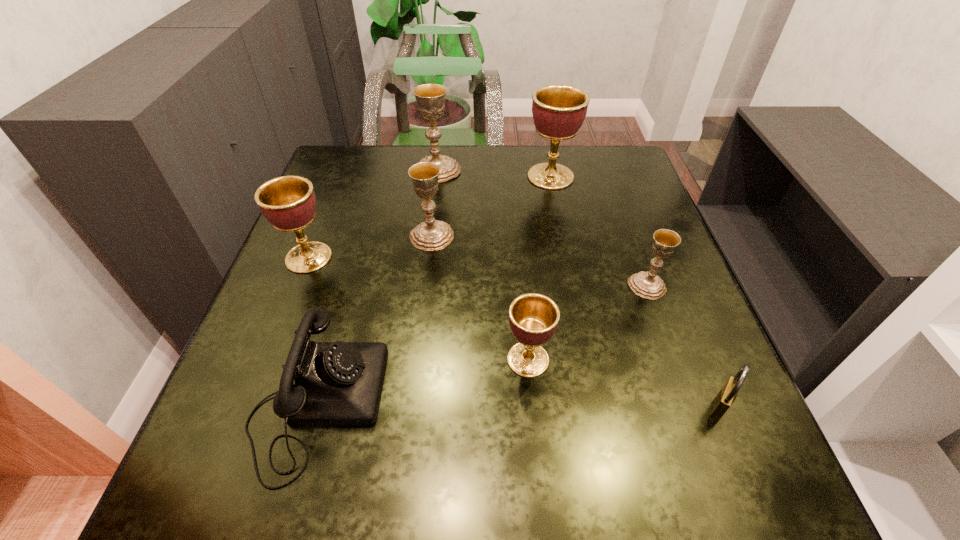
Where is `the biggest gold chalice`? The height and width of the screenshot is (540, 960). the biggest gold chalice is located at coordinates (430, 98).

I want to click on the farthest golden chalice, so click(x=559, y=111).

Image resolution: width=960 pixels, height=540 pixels. Identify the location of the second farthest gold chalice. (432, 234).

The width and height of the screenshot is (960, 540). Identify the location of the leftmost golden chalice. (288, 202).

Identify the location of the second smallest golden chalice. click(288, 202).

The width and height of the screenshot is (960, 540). I want to click on the nearest gold chalice, so click(648, 284).

Image resolution: width=960 pixels, height=540 pixels. I want to click on the rightmost chalice, so click(x=648, y=284).

Find the location of a particular element. the smallest golden chalice is located at coordinates (533, 318).

The width and height of the screenshot is (960, 540). In order to click on the nearest golden chalice in this screenshot , I will do `click(533, 318)`.

At what (x,y) coordinates should I click in order to perform the action: click on telephone. Please return your answer as a coordinate pair (x, y). The width and height of the screenshot is (960, 540). Looking at the image, I should click on 338,383.